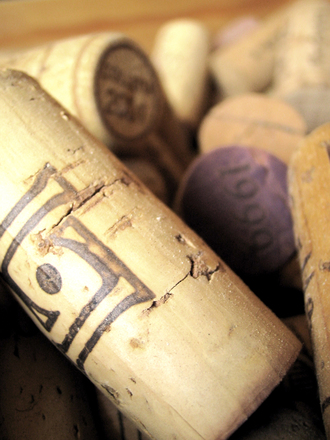
What are the coordinates of `brown cork` in the screenshot? It's located at (180, 375).